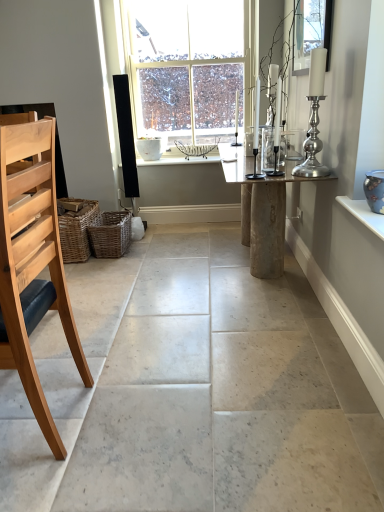
Where is `vacant space underneath natural wood chair at left (from a real-world perspective)`? vacant space underneath natural wood chair at left (from a real-world perspective) is located at coordinates (35, 430).